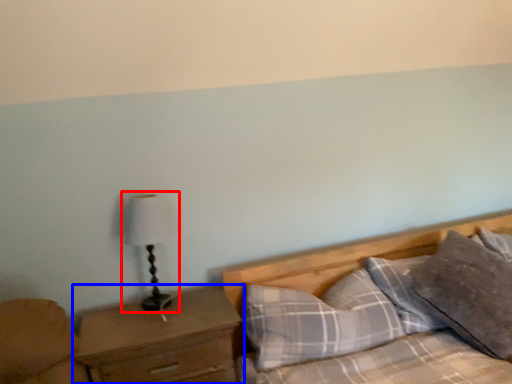
Question: Which object appears farthest to the camera in this image, table lamp (highlighted by a red box) or nightstand (highlighted by a blue box)?

Choices:
 (A) table lamp
 (B) nightstand

Answer: (A)